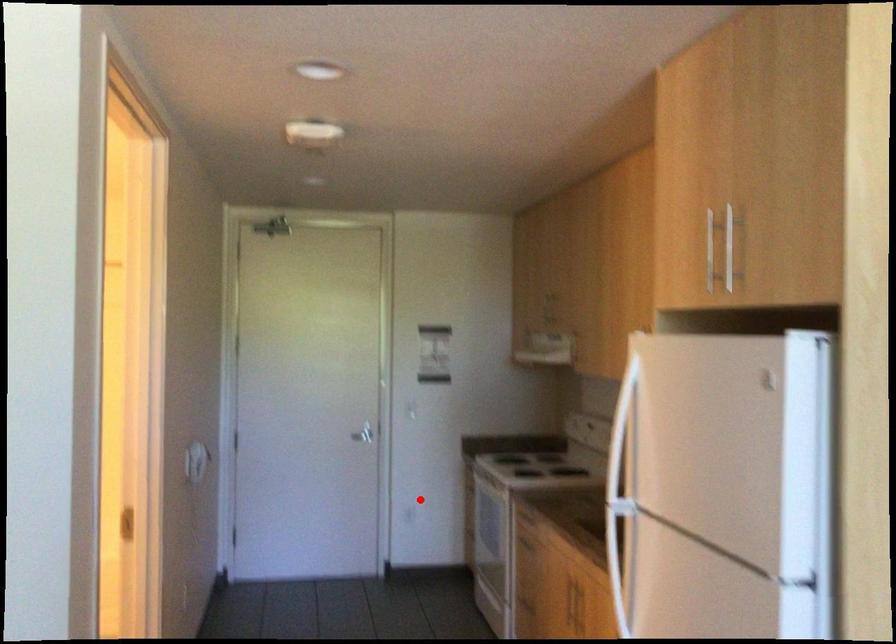
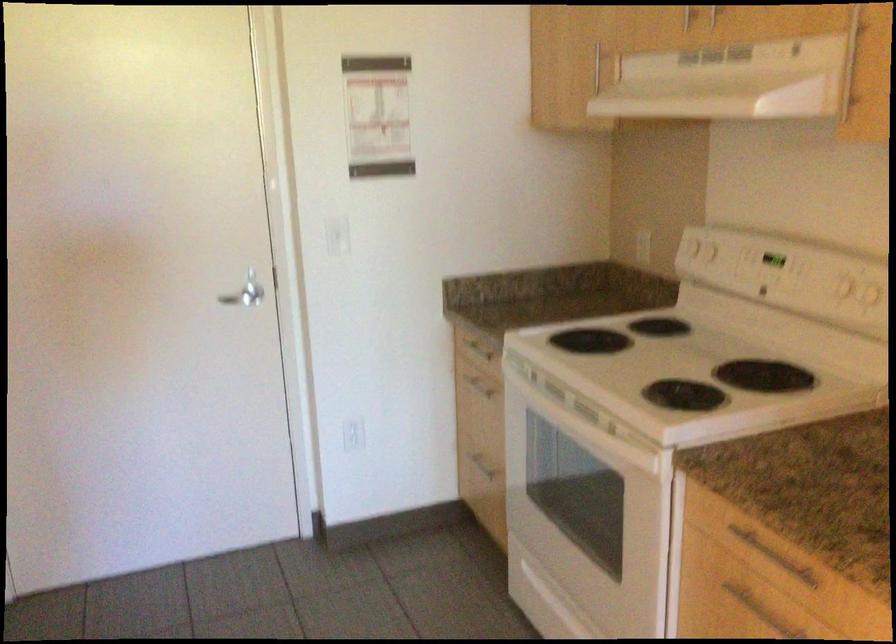
The point at the highlighted location is marked in the first image. Where is the corresponding point in the second image?

(352, 433)